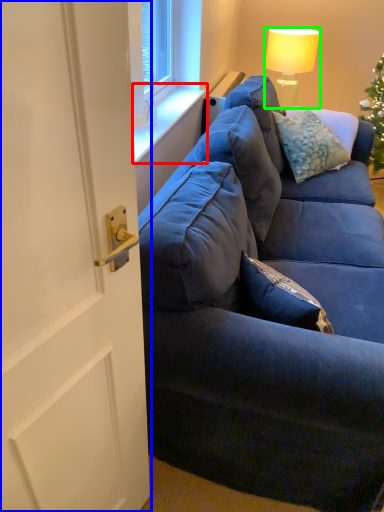
Question: Estimate the real-world distances between objects in this image. Which object is closer to window sill (highlighted by a red box), door (highlighted by a blue box) or lamp (highlighted by a green box)?

Choices:
 (A) door
 (B) lamp

Answer: (B)